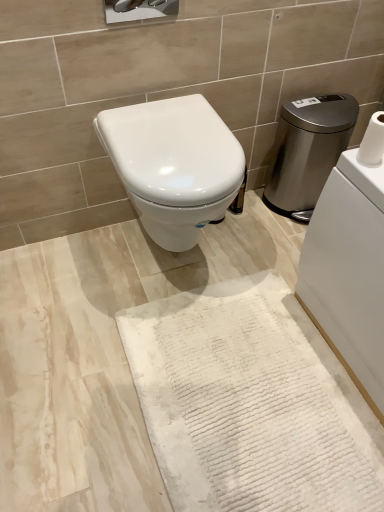
The height and width of the screenshot is (512, 384). Find the location of `vacant region to the left of white textured bath mat at center`. vacant region to the left of white textured bath mat at center is located at coordinates (71, 367).